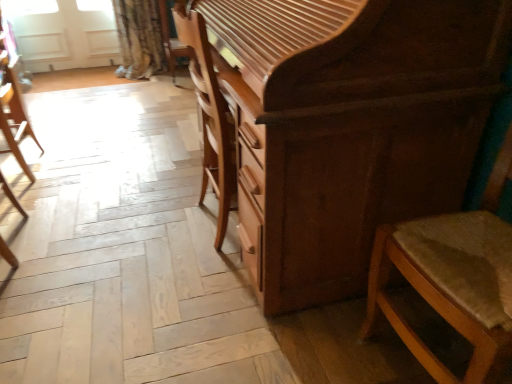
Question: Should I look upward or downward to see white matte screen door at upper left?

Choices:
 (A) up
 (B) down

Answer: (A)

Question: Is shiny brown chest of drawers at center smaller than wooden chair at left, placed as the first chair when sorted from back to front?

Choices:
 (A) yes
 (B) no

Answer: (B)

Question: Is shiny brown chest of drawers at center turned away from wooden chair at left, which is counted as the 1th chair, starting from the left?

Choices:
 (A) no
 (B) yes

Answer: (A)

Question: Is wooden chair at left, which appears as the second chair when viewed from the front, inside shiny brown chest of drawers at center?

Choices:
 (A) yes
 (B) no

Answer: (B)

Question: Can you confirm if shiny brown chest of drawers at center is wider than wooden chair at left, the 2th chair in the right-to-left sequence?

Choices:
 (A) no
 (B) yes

Answer: (B)

Question: Is shiny brown chest of drawers at center with wooden chair at left, the 2th chair in the right-to-left sequence?

Choices:
 (A) yes
 (B) no

Answer: (B)

Question: Considering the relative sizes of shiny brown chest of drawers at center and wooden chair at left, which is counted as the 1th chair, starting from the left, in the image provided, is shiny brown chest of drawers at center thinner than wooden chair at left, which is counted as the 1th chair, starting from the left,?

Choices:
 (A) no
 (B) yes

Answer: (A)

Question: Is wooden chair at left, the 2th chair in the right-to-left sequence, bigger than white matte screen door at upper left?

Choices:
 (A) no
 (B) yes

Answer: (B)

Question: Is wooden chair at left, which appears as the second chair when viewed from the front, taller than white matte screen door at upper left?

Choices:
 (A) yes
 (B) no

Answer: (A)

Question: Is white matte screen door at upper left surrounded by wooden chair at left, the 2th chair in the right-to-left sequence?

Choices:
 (A) yes
 (B) no

Answer: (B)

Question: From the image's perspective, is wooden chair at left, which is counted as the 1th chair, starting from the left, over white matte screen door at upper left?

Choices:
 (A) no
 (B) yes

Answer: (A)

Question: Is wooden chair at left, which is counted as the 1th chair, starting from the left, thinner than white matte screen door at upper left?

Choices:
 (A) yes
 (B) no

Answer: (B)

Question: Considering the relative positions of wooden chair at left, placed as the first chair when sorted from back to front, and white matte screen door at upper left in the image provided, is wooden chair at left, placed as the first chair when sorted from back to front, behind white matte screen door at upper left?

Choices:
 (A) yes
 (B) no

Answer: (B)

Question: Considering the relative sizes of wooden textured chair at right, the 2th chair in the left-to-right sequence, and shiny brown chest of drawers at center in the image provided, is wooden textured chair at right, the 2th chair in the left-to-right sequence, smaller than shiny brown chest of drawers at center?

Choices:
 (A) no
 (B) yes

Answer: (B)